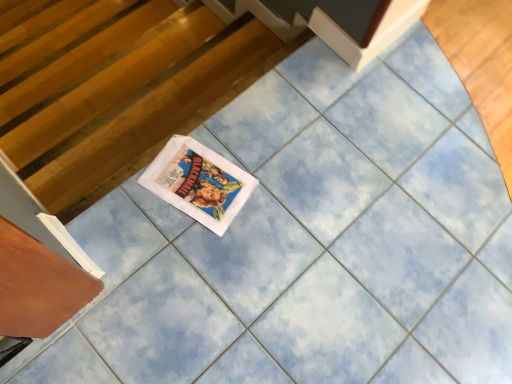
Question: Would you say white paper comic book at center is a long distance from wooden drawer at lower left?

Choices:
 (A) yes
 (B) no

Answer: (B)

Question: Is white paper comic book at center to the right of wooden drawer at lower left from the viewer's perspective?

Choices:
 (A) no
 (B) yes

Answer: (B)

Question: Is wooden drawer at lower left completely or partially inside white paper comic book at center?

Choices:
 (A) yes
 (B) no

Answer: (B)

Question: Is white paper comic book at center bigger than wooden drawer at lower left?

Choices:
 (A) no
 (B) yes

Answer: (A)

Question: Is white paper comic book at center smaller than wooden drawer at lower left?

Choices:
 (A) yes
 (B) no

Answer: (A)

Question: From a real-world perspective, is white paper comic book at center below wooden drawer at lower left?

Choices:
 (A) yes
 (B) no

Answer: (A)

Question: From the image's perspective, is white paper comic book at center on wooden at left?

Choices:
 (A) yes
 (B) no

Answer: (B)

Question: Is the surface of white paper comic book at center in direct contact with wooden at left?

Choices:
 (A) no
 (B) yes

Answer: (A)

Question: Is white paper comic book at center positioned far away from wooden at left?

Choices:
 (A) no
 (B) yes

Answer: (A)

Question: Considering the relative positions of white paper comic book at center and wooden at left in the image provided, is white paper comic book at center behind wooden at left?

Choices:
 (A) no
 (B) yes

Answer: (A)

Question: Can you confirm if white paper comic book at center is positioned to the right of wooden at left?

Choices:
 (A) no
 (B) yes

Answer: (B)

Question: Is white paper comic book at center shorter than wooden at left?

Choices:
 (A) no
 (B) yes

Answer: (B)

Question: Is wooden at left thinner than white paper comic book at center?

Choices:
 (A) no
 (B) yes

Answer: (B)